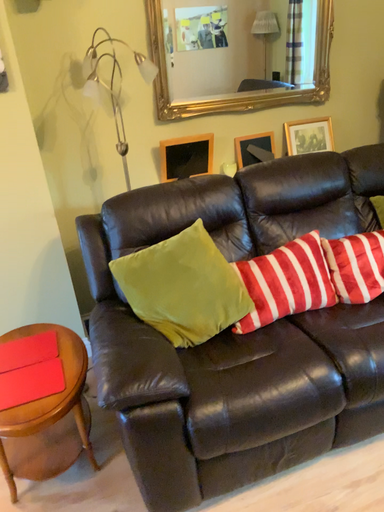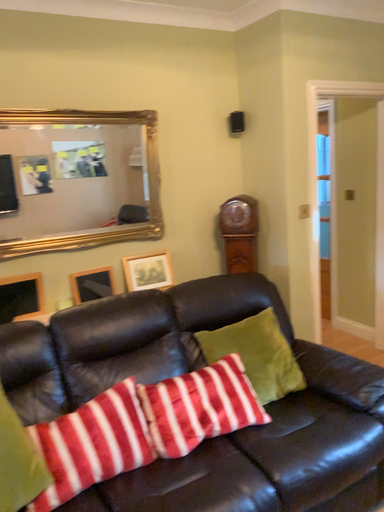
Question: How did the camera likely rotate when shooting the video?

Choices:
 (A) rotated left
 (B) rotated right

Answer: (B)